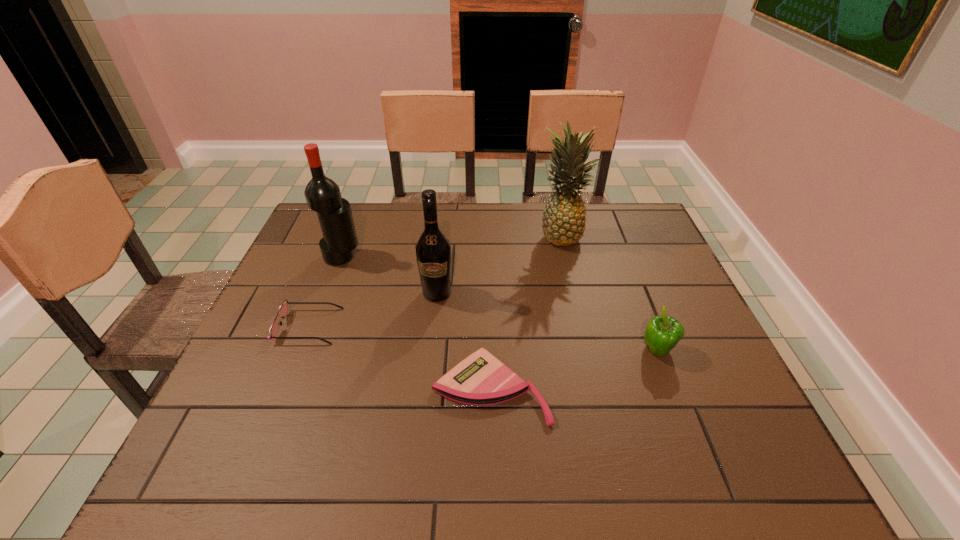
This screenshot has height=540, width=960. What are the coordinates of `vacant point located between the shortest object and the fifth object from left to right` in the screenshot? It's located at (526, 312).

Image resolution: width=960 pixels, height=540 pixels. Identify the location of blank region between the rightmost object and the sunglasses. (483, 339).

Identify which object is the nearest to the bell pepper. Please provide its 2D coordinates. Your answer should be formatted as a tuple, i.e. [(x, y)], where the tuple contains the x and y coordinates of a point satisfying the conditions above.

[(480, 379)]

Locate which object ranks fifth in proximity to the shortest object. Please provide its 2D coordinates. Your answer should be formatted as a tuple, i.e. [(x, y)], where the tuple contains the x and y coordinates of a point satisfying the conditions above.

[(322, 194)]

Locate an element on the screen. The height and width of the screenshot is (540, 960). free location that satisfies the following two spatial constraints: 1. on the bridge of the wristlet; 2. on the right side of the fifth tallest object is located at coordinates (284, 388).

Where is `free space that satisfies the following two spatial constraints: 1. on the bridge of the sunglasses; 2. on the back side of the bell pepper`? The image size is (960, 540). free space that satisfies the following two spatial constraints: 1. on the bridge of the sunglasses; 2. on the back side of the bell pepper is located at coordinates (299, 351).